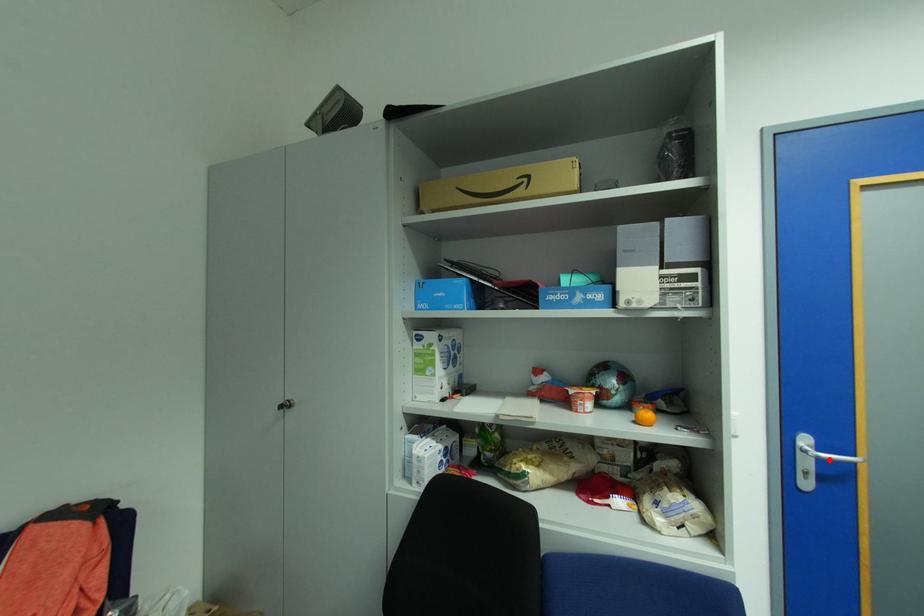
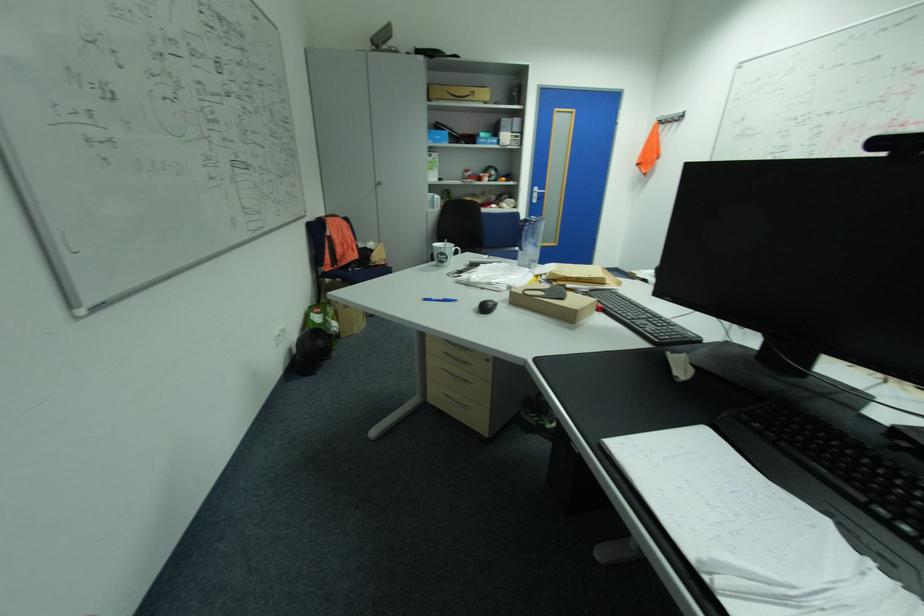
Question: I am providing you with two images of the same scene from different viewpoints. A red point is marked on the first image. Is the red point's position out of view in image 2?

Choices:
 (A) Yes
 (B) No

Answer: (B)